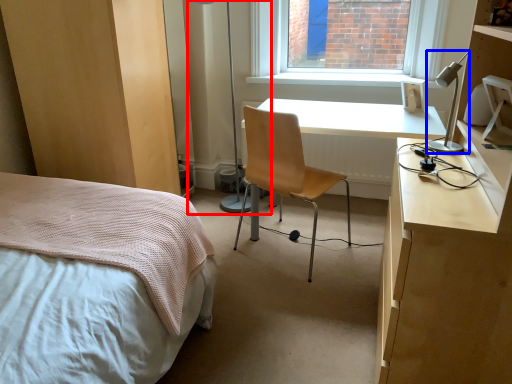
Question: Which of the following is the closest to the observer, table lamp (highlighted by a red box) or lamp (highlighted by a blue box)?

Choices:
 (A) table lamp
 (B) lamp

Answer: (B)